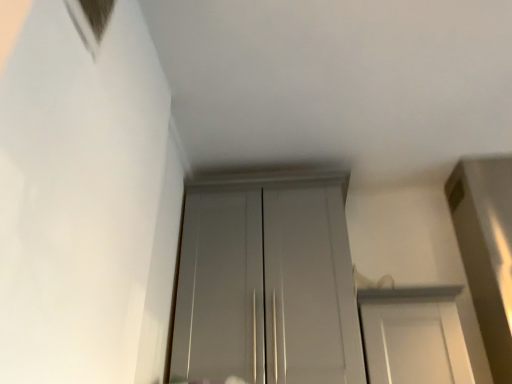
Question: Which direction should I rotate to look at white glossy door at center, which is counted as the second door, starting from the left, — up or down?

Choices:
 (A) up
 (B) down

Answer: (B)

Question: Should I look upward or downward to see glossy white door at center, the first door in the left-to-right sequence?

Choices:
 (A) up
 (B) down

Answer: (B)

Question: From a real-world perspective, is white glossy door at center, which is counted as the second door, starting from the left, over glossy white door at center, the first door in the left-to-right sequence?

Choices:
 (A) yes
 (B) no

Answer: (B)

Question: Considering the relative sizes of white glossy door at center, which is counted as the second door, starting from the left, and glossy white door at center, the first door in the left-to-right sequence, in the image provided, is white glossy door at center, which is counted as the second door, starting from the left, shorter than glossy white door at center, the first door in the left-to-right sequence,?

Choices:
 (A) yes
 (B) no

Answer: (A)

Question: Does white glossy door at center, which is counted as the second door, starting from the left, lie in front of glossy white door at center, positioned as the second door in right-to-left order?

Choices:
 (A) no
 (B) yes

Answer: (B)

Question: From the image's perspective, is white glossy door at center, which is counted as the first door, starting from the right, located beneath glossy white door at center, the first door in the left-to-right sequence?

Choices:
 (A) yes
 (B) no

Answer: (A)

Question: Is white glossy door at center, which is counted as the second door, starting from the left, thinner than glossy white door at center, positioned as the second door in right-to-left order?

Choices:
 (A) no
 (B) yes

Answer: (A)

Question: Is white glossy door at center, which is counted as the first door, starting from the right, at the left side of glossy white door at center, positioned as the second door in right-to-left order?

Choices:
 (A) yes
 (B) no

Answer: (B)

Question: From a real-world perspective, does glossy white door at center, the first door in the left-to-right sequence, sit lower than white glossy door at center, which is counted as the first door, starting from the right?

Choices:
 (A) no
 (B) yes

Answer: (A)

Question: From the image's perspective, is glossy white door at center, positioned as the second door in right-to-left order, located above white glossy door at center, which is counted as the first door, starting from the right?

Choices:
 (A) yes
 (B) no

Answer: (A)

Question: Considering the relative positions of glossy white door at center, positioned as the second door in right-to-left order, and white glossy door at center, which is counted as the second door, starting from the left, in the image provided, is glossy white door at center, positioned as the second door in right-to-left order, to the right of white glossy door at center, which is counted as the second door, starting from the left, from the viewer's perspective?

Choices:
 (A) yes
 (B) no

Answer: (B)

Question: Is glossy white door at center, positioned as the second door in right-to-left order, positioned with its back to white glossy door at center, which is counted as the second door, starting from the left?

Choices:
 (A) yes
 (B) no

Answer: (B)

Question: Is glossy white door at center, positioned as the second door in right-to-left order, closer to camera compared to white glossy door at center, which is counted as the second door, starting from the left?

Choices:
 (A) yes
 (B) no

Answer: (B)

Question: From a real-world perspective, is glossy white door at center, the first door in the left-to-right sequence, over white glossy door at center, which is counted as the second door, starting from the left?

Choices:
 (A) yes
 (B) no

Answer: (A)

Question: From their relative heights in the image, would you say white glossy door at center, which is counted as the second door, starting from the left, is taller or shorter than glossy white door at center, positioned as the second door in right-to-left order?

Choices:
 (A) tall
 (B) short

Answer: (B)